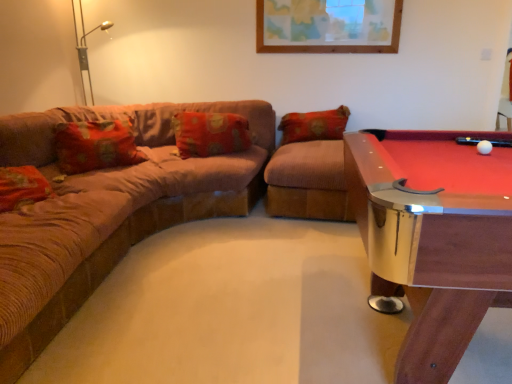
Question: From a real-world perspective, does wooden pool table at right stand above floral fabric pillow at center?

Choices:
 (A) yes
 (B) no

Answer: (B)

Question: Is wooden pool table at right positioned beyond the bounds of floral fabric pillow at center?

Choices:
 (A) yes
 (B) no

Answer: (A)

Question: From a real-world perspective, is wooden pool table at right physically below floral fabric pillow at center?

Choices:
 (A) yes
 (B) no

Answer: (A)

Question: Is wooden pool table at right positioned with its back to floral fabric pillow at center?

Choices:
 (A) no
 (B) yes

Answer: (A)

Question: Is wooden pool table at right closer to camera compared to floral fabric pillow at center?

Choices:
 (A) yes
 (B) no

Answer: (A)

Question: Considering the relative positions of wooden pool table at right and brown corduroy couch at left in the image provided, is wooden pool table at right to the left or to the right of brown corduroy couch at left?

Choices:
 (A) left
 (B) right

Answer: (B)

Question: From a real-world perspective, is wooden pool table at right positioned above or below brown corduroy couch at left?

Choices:
 (A) below
 (B) above

Answer: (B)

Question: Would you say wooden pool table at right is inside or outside brown corduroy couch at left?

Choices:
 (A) outside
 (B) inside

Answer: (A)

Question: Is point (415, 322) closer or farther from the camera than point (103, 266)?

Choices:
 (A) closer
 (B) farther

Answer: (A)

Question: From a real-world perspective, is brown corduroy couch at left positioned above or below wooden pool table at right?

Choices:
 (A) above
 (B) below

Answer: (B)

Question: Relative to wooden pool table at right, is brown corduroy couch at left in front or behind?

Choices:
 (A) behind
 (B) front

Answer: (B)

Question: Is brown corduroy couch at left spatially inside wooden pool table at right, or outside of it?

Choices:
 (A) outside
 (B) inside

Answer: (A)

Question: Considering the positions of brown corduroy couch at left and wooden pool table at right in the image, is brown corduroy couch at left taller or shorter than wooden pool table at right?

Choices:
 (A) tall
 (B) short

Answer: (B)

Question: Considering the positions of floral fabric pillow at center and wooden pool table at right in the image, is floral fabric pillow at center wider or thinner than wooden pool table at right?

Choices:
 (A) wide
 (B) thin

Answer: (B)

Question: Visually, is floral fabric pillow at center positioned to the left or to the right of wooden pool table at right?

Choices:
 (A) right
 (B) left

Answer: (B)